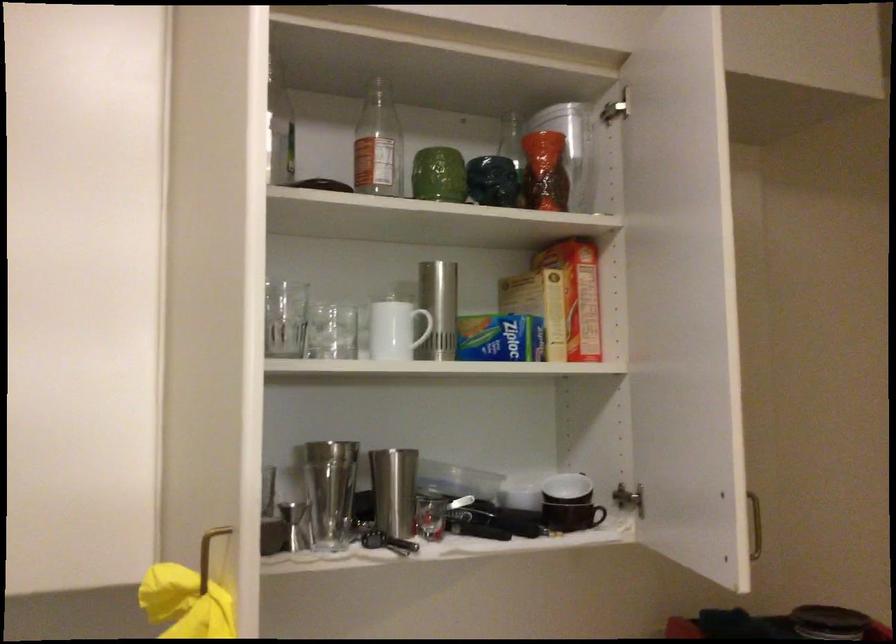
Find the location of `white mug handle`. white mug handle is located at coordinates (421, 323).